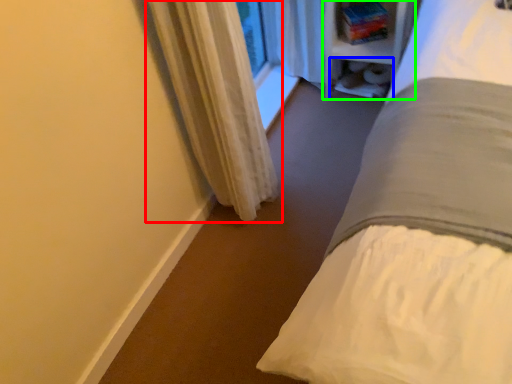
Question: Which object is the closest to the curtain (highlighted by a red box)? Choose among these: shelf (highlighted by a blue box) or bookshelf (highlighted by a green box).

Choices:
 (A) shelf
 (B) bookshelf

Answer: (B)